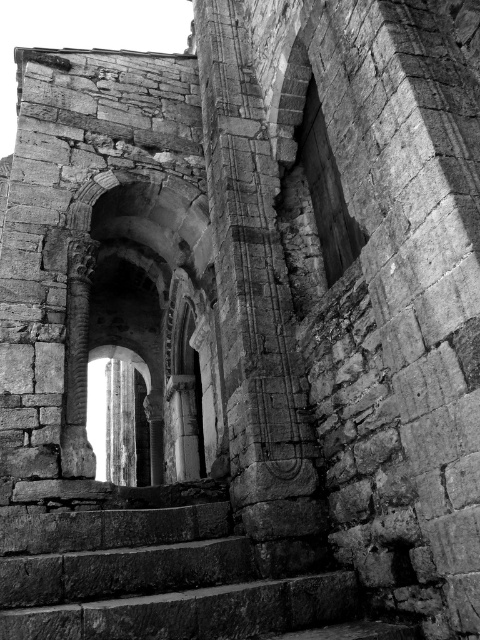
Is stone archway at center shorter than rough stone stairs at center?

No, stone archway at center is not shorter than rough stone stairs at center.

Which of these two, stone archway at center or rough stone stairs at center, stands taller?

stone archway at center is taller.

The image size is (480, 640). In order to click on stone archway at center in this screenshot , I will do `click(144, 323)`.

The height and width of the screenshot is (640, 480). In order to click on stone archway at center in this screenshot , I will do `click(144, 323)`.